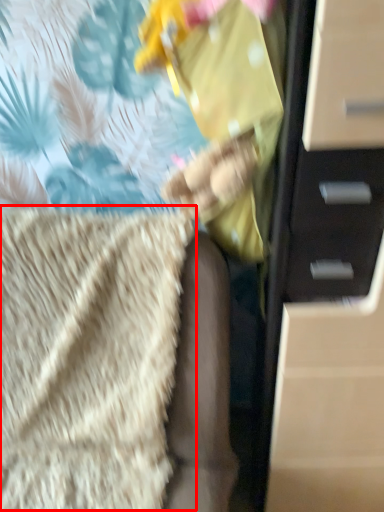
Question: Considering the relative positions of blanket (annotated by the red box) and chest of drawers in the image provided, where is blanket (annotated by the red box) located with respect to the staircase?

Choices:
 (A) right
 (B) left

Answer: (B)